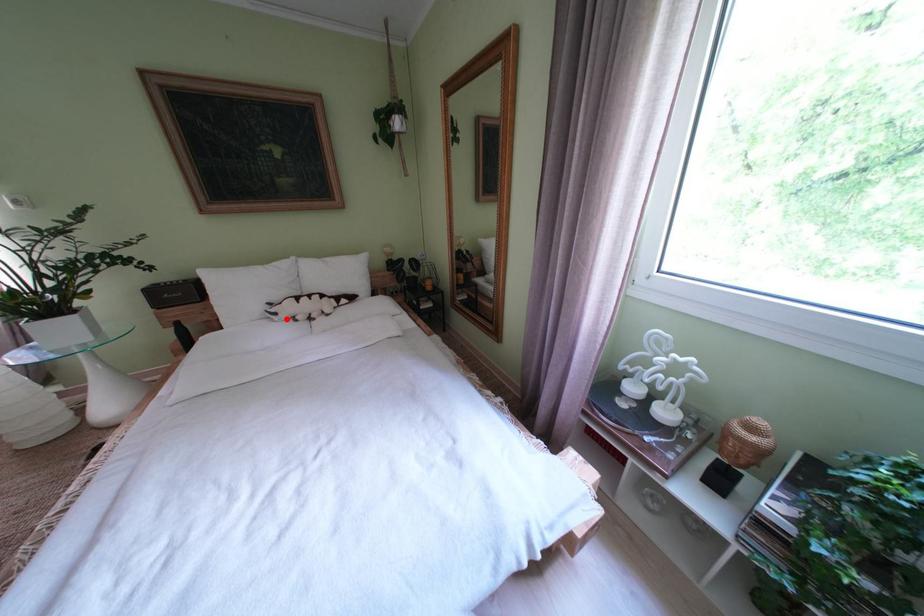
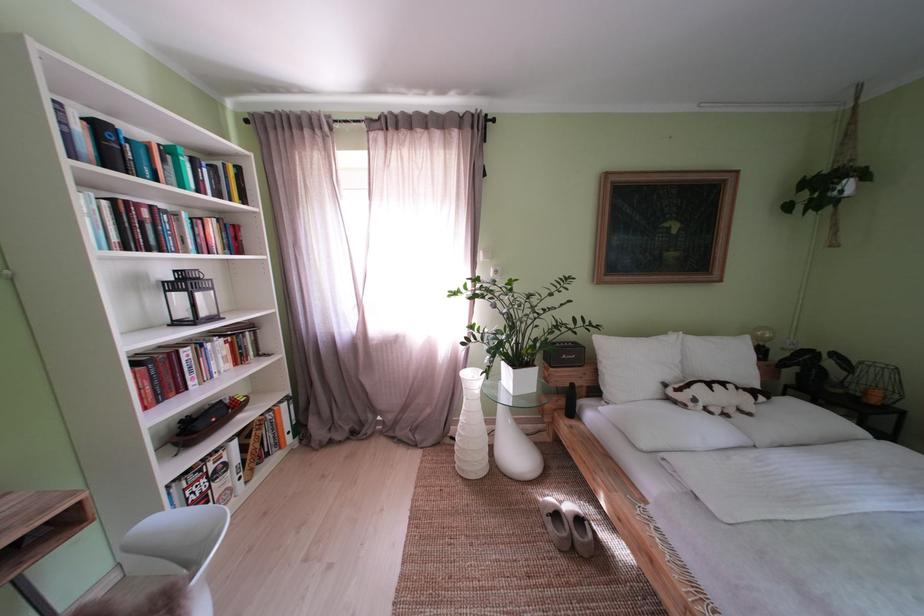
The point at the highlighted location is marked in the first image. Where is the corresponding point in the second image?

(706, 406)